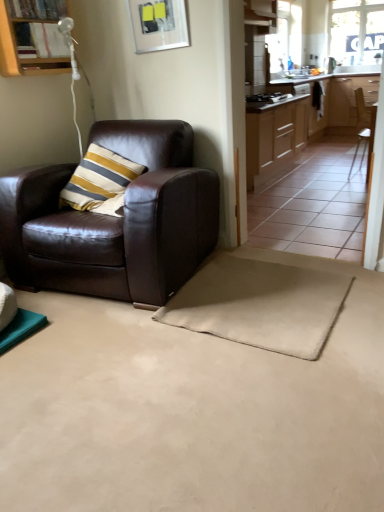
You are a GUI agent. You are given a task and a screenshot of the screen. Output one action in this format:
    pyautogui.click(x=<x>, y=<y>)
    Task: Click on the free spot in front of beige suede yoga mat at lower center
    
    Given the screenshot: What is the action you would take?
    pyautogui.click(x=258, y=408)